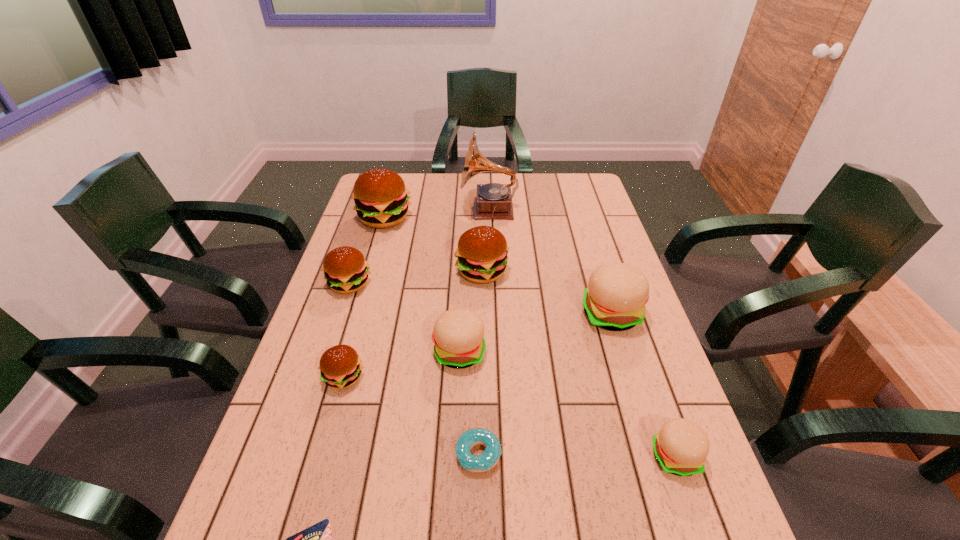
The height and width of the screenshot is (540, 960). I want to click on vacant area situated 0.280m on the back of the smallest beige hamburger, so click(x=633, y=335).

Where is `vacant space located 0.120m on the back of the ninth tallest object`? vacant space located 0.120m on the back of the ninth tallest object is located at coordinates (479, 387).

The height and width of the screenshot is (540, 960). I want to click on phonograph_record at the far edge, so click(x=494, y=201).

Locate an element on the screen. The width and height of the screenshot is (960, 540). hamburger that is positioned at the far edge is located at coordinates (381, 201).

The height and width of the screenshot is (540, 960). I want to click on object that is at the far left corner, so click(x=381, y=201).

In the image, there is a desktop. Where is `vacant space at the far edge`? The width and height of the screenshot is (960, 540). vacant space at the far edge is located at coordinates (458, 194).

Where is `blank area at the left edge`? This screenshot has width=960, height=540. blank area at the left edge is located at coordinates (380, 276).

This screenshot has width=960, height=540. Find the location of `blank space at the right edge`. blank space at the right edge is located at coordinates (598, 263).

The width and height of the screenshot is (960, 540). In the image, there is a desktop. Find the location of `vacant space at the far right corner`. vacant space at the far right corner is located at coordinates (573, 204).

Locate an element on the screen. vacant space that is in between the smallest brown hamburger and the tallest object is located at coordinates (417, 293).